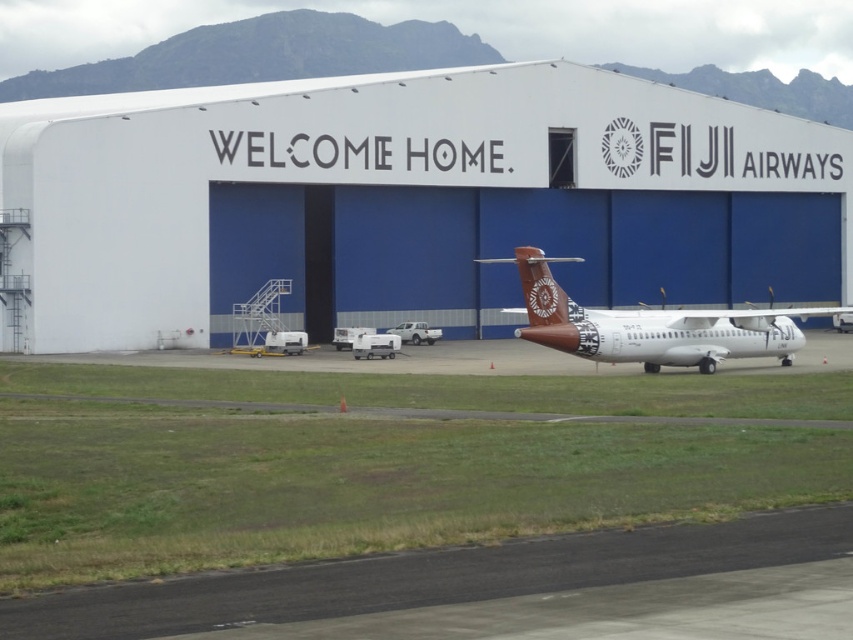
Is white smooth hangar at center shorter than brown matte airplane at center?

Incorrect, white smooth hangar at center's height does not fall short of brown matte airplane at center's.

Who is higher up, white smooth hangar at center or brown matte airplane at center?

white smooth hangar at center

Is point (727, 269) in front of point (795, 333)?

No, (727, 269) is behind (795, 333).

Locate an element on the screen. The height and width of the screenshot is (640, 853). white smooth hangar at center is located at coordinates (403, 202).

Identify the location of white smooth hangar at center. (403, 202).

Does white smooth hangar at center have a lesser height compared to black asphalt runway at lower center?

Incorrect, white smooth hangar at center's height does not fall short of black asphalt runway at lower center's.

Is point (569, 196) more distant than point (265, 582)?

Yes, point (569, 196) is farther from viewer.

Locate an element on the screen. This screenshot has width=853, height=640. white smooth hangar at center is located at coordinates [x=403, y=202].

Is black asphalt runway at lower center positioned behind brown matte airplane at center?

That is False.

Can you confirm if black asphalt runway at lower center is shorter than brown matte airplane at center?

Indeed, black asphalt runway at lower center has a lesser height compared to brown matte airplane at center.

Looking at this image, who is more forward, (x=300, y=616) or (x=682, y=349)?

Positioned in front is point (x=300, y=616).

Identify the location of black asphalt runway at lower center. (428, 576).